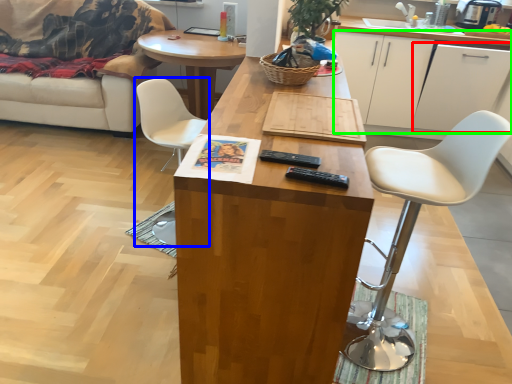
Question: Which object is the closest to the cabinetry (highlighted by a red box)? Choose among these: chair (highlighted by a blue box) or cabinetry (highlighted by a green box).

Choices:
 (A) chair
 (B) cabinetry

Answer: (B)